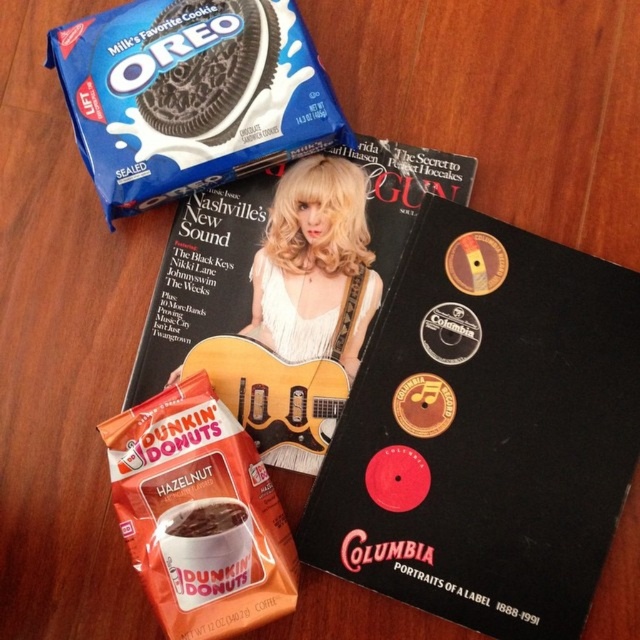
Does orange matte dunkin' donuts hazelnut coffee at lower left lie behind matte black magazine at upper center?

No, it is not.

You are a GUI agent. You are given a task and a screenshot of the screen. Output one action in this format:
    pyautogui.click(x=<x>, y=<y>)
    Task: Click on the orange matte dunkin' donuts hazelnut coffee at lower left
    Image resolution: width=640 pixels, height=640 pixels.
    Given the screenshot: What is the action you would take?
    pyautogui.click(x=198, y=515)

Which of these two, blue matte oreo at upper left or matte black magazine at upper center, stands shorter?

blue matte oreo at upper left

Is blue matte oreo at upper left below matte black magazine at upper center?

No.

Who is more distant from viewer, (212, 166) or (209, 221)?

Point (209, 221)

Locate an element on the screen. The image size is (640, 640). blue matte oreo at upper left is located at coordinates [189, 96].

Where is `black matte book at upper center`? The image size is (640, 640). black matte book at upper center is located at coordinates (484, 429).